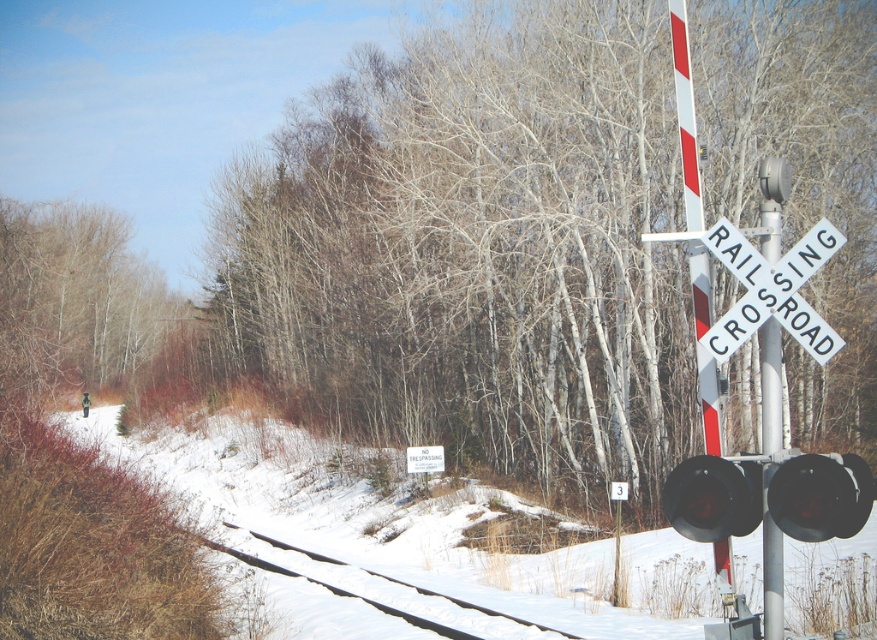
Can you confirm if black matte traffic light at center is positioned below black metal train track at lower left?

Incorrect, black matte traffic light at center is not positioned below black metal train track at lower left.

Does point (692, 512) lie behind point (525, 634)?

That is False.

Does point (676, 524) lie in front of point (462, 611)?

That is True.

The image size is (877, 640). Find the location of `black matte traffic light at center`. black matte traffic light at center is located at coordinates (769, 497).

Does smooth white tree at center appear on the left side of black glass traffic light at right?

Indeed, smooth white tree at center is positioned on the left side of black glass traffic light at right.

Is smooth white tree at center closer to camera compared to black glass traffic light at right?

No, smooth white tree at center is further to the viewer.

Find the location of a particular element. This screenshot has height=640, width=877. smooth white tree at center is located at coordinates (476, 252).

Who is more distant from viewer, (290, 237) or (248, 550)?

The point (290, 237) is more distant.

Is point (428, 147) more distant than point (241, 528)?

Yes, it is behind point (241, 528).

At what (x,y) coordinates should I click in order to perform the action: click on smooth white tree at center. Please return your answer as a coordinate pair (x, y). The height and width of the screenshot is (640, 877). Looking at the image, I should click on [x=476, y=252].